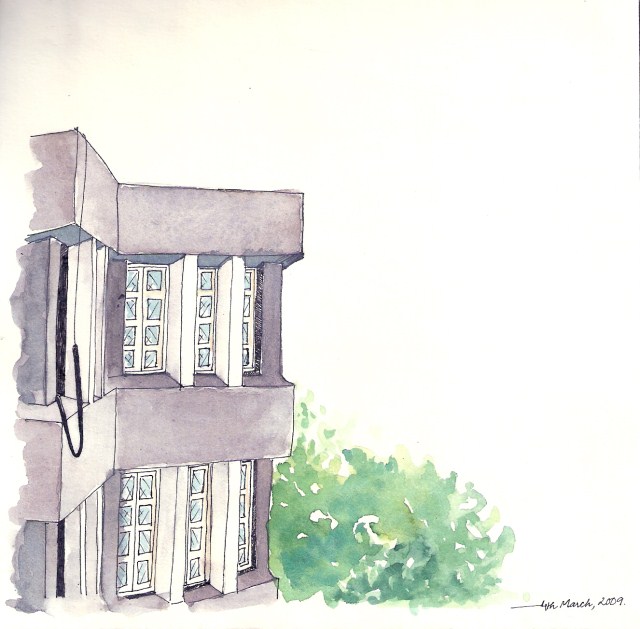
At what (x,y) coordinates should I click in order to perform the action: click on white concrete wall to right of window. Please return your answer as a coordinate pair (x, y). Image resolution: width=640 pixels, height=629 pixels. Looking at the image, I should click on (221, 521), (168, 529), (182, 329), (232, 319).